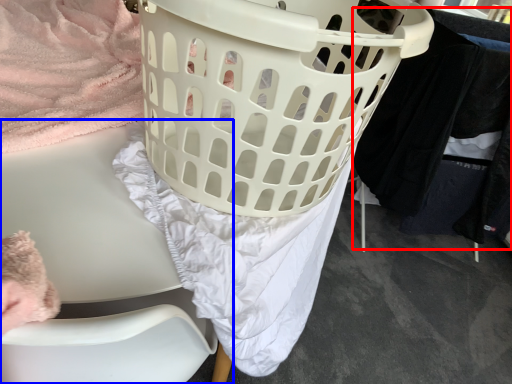
Question: Among these objects, which one is farthest to the camera, clothing (highlighted by a red box) or furniture (highlighted by a blue box)?

Choices:
 (A) clothing
 (B) furniture

Answer: (A)